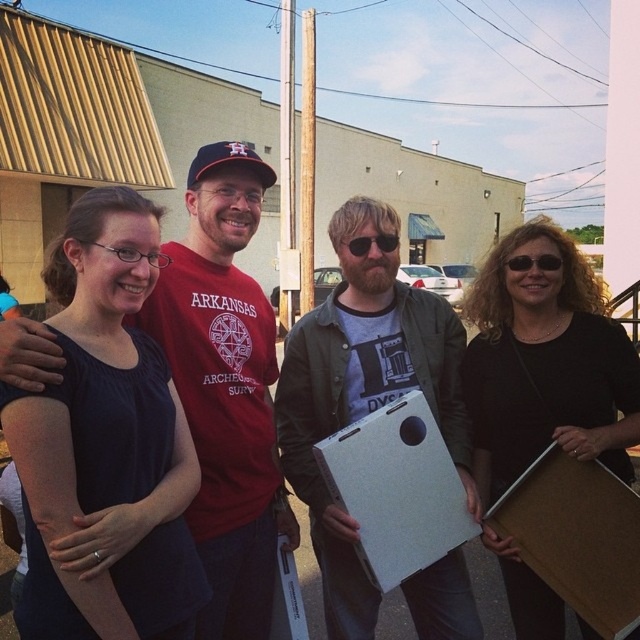
Can you confirm if matte red t-shirt at center is shorter than black matte sunglasses at center?

In fact, matte red t-shirt at center may be taller than black matte sunglasses at center.

Which of these two, matte red t-shirt at center or black matte sunglasses at center, stands taller?

matte red t-shirt at center is taller.

The width and height of the screenshot is (640, 640). I want to click on matte red t-shirt at center, so click(x=227, y=198).

Does matte red t-shirt at center appear over black plastic sunglasses at center?

Yes.

Can you confirm if matte red t-shirt at center is taller than black plastic sunglasses at center?

Yes.

Find the location of a particular element. The image size is (640, 640). matte red t-shirt at center is located at coordinates (227, 198).

This screenshot has height=640, width=640. I want to click on matte red t-shirt at center, so click(227, 198).

Measure the distance between matte gray laptop at center and camera.

A distance of 2.58 meters exists between matte gray laptop at center and camera.

Which is above, matte gray laptop at center or white matte cardboard box at center?

matte gray laptop at center is higher up.

Which is in front, point (401, 340) or point (419, 412)?

Point (419, 412) is more forward.

The height and width of the screenshot is (640, 640). Find the location of `matte gray laptop at center`. matte gray laptop at center is located at coordinates (364, 394).